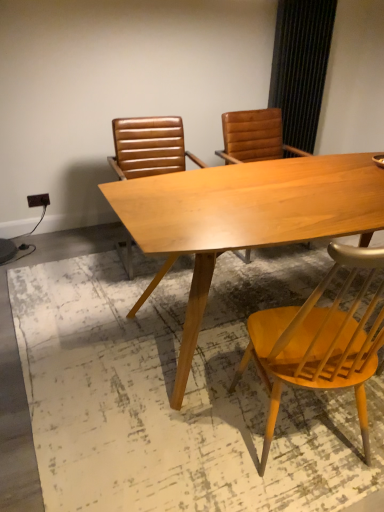
The width and height of the screenshot is (384, 512). I want to click on vacant area on top of light wood table at center (from a real-world perspective), so click(269, 187).